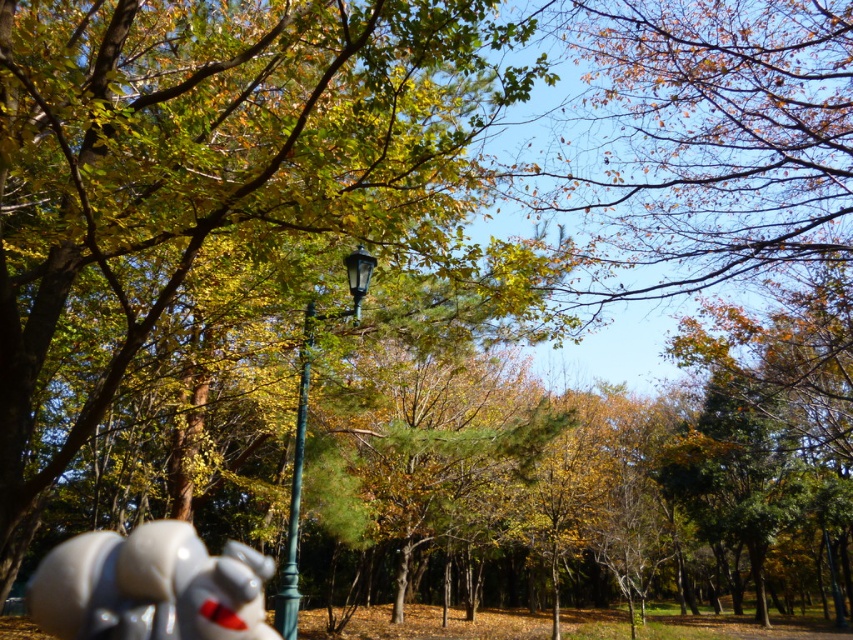
Is point (227, 570) farther from camera compared to point (294, 522)?

No, (227, 570) is in front of (294, 522).

Does white glossy statue at lower left have a greater width compared to green metal lamp post at center?

Yes.

What do you see at coordinates (149, 586) in the screenshot? Image resolution: width=853 pixels, height=640 pixels. I see `white glossy statue at lower left` at bounding box center [149, 586].

Locate an element on the screen. The width and height of the screenshot is (853, 640). white glossy statue at lower left is located at coordinates (149, 586).